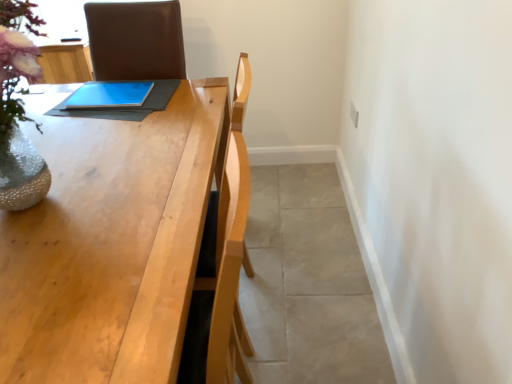
Question: Looking at the image, does blue matte tablet at center seem bigger or smaller compared to light wood table at center?

Choices:
 (A) big
 (B) small

Answer: (B)

Question: In the image, is blue matte tablet at center positioned in front of or behind light wood table at center?

Choices:
 (A) behind
 (B) front

Answer: (A)

Question: Estimate the real-world distances between objects in this image. Which object is closer to the blue matte tablet at center?

Choices:
 (A) gray tile floor at lower right
 (B) light wood table at center

Answer: (B)

Question: Based on their relative distances, which object is nearer to the blue matte tablet at center?

Choices:
 (A) light wood table at center
 (B) gray tile floor at lower right

Answer: (A)